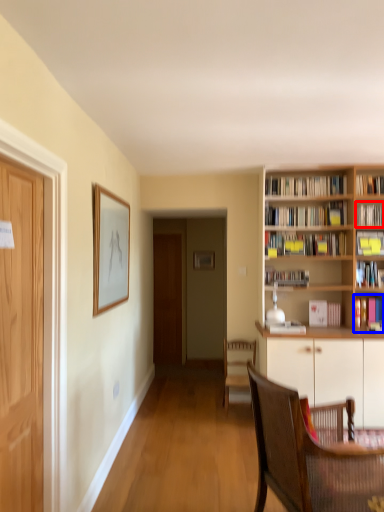
Question: Which of the following is the farthest to the observer, book (highlighted by a red box) or book (highlighted by a blue box)?

Choices:
 (A) book
 (B) book

Answer: (A)